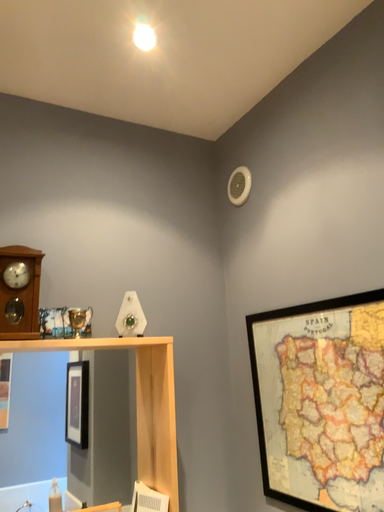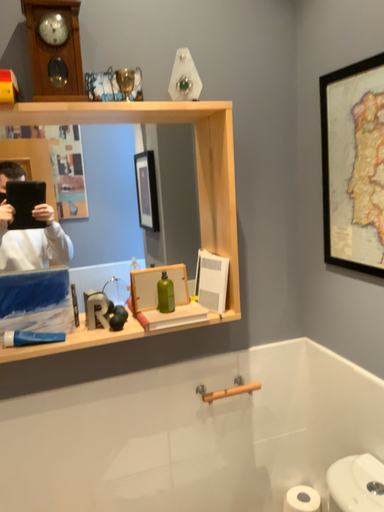
Question: How did the camera likely rotate when shooting the video?

Choices:
 (A) rotated left
 (B) rotated right

Answer: (A)